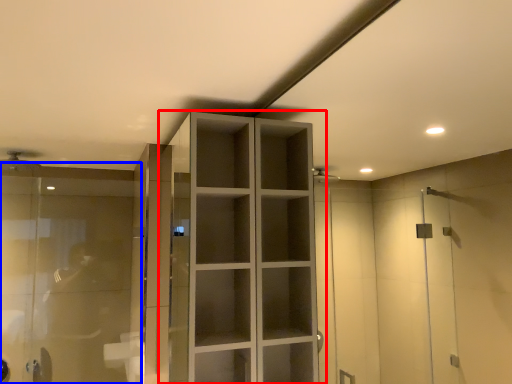
Question: Which of the following is the closest to the observer, cupboard (highlighted by a red box) or glass door (highlighted by a blue box)?

Choices:
 (A) cupboard
 (B) glass door

Answer: (A)